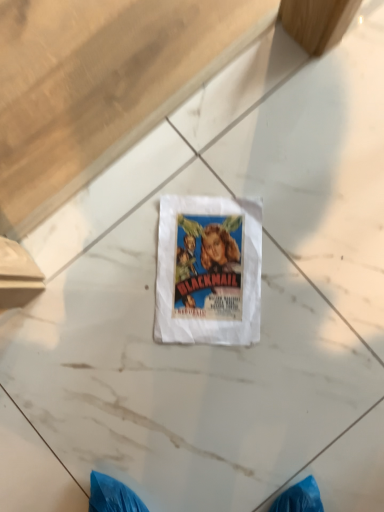
Identify the location of free location to the right of colorful paper poster at center. The width and height of the screenshot is (384, 512). (307, 225).